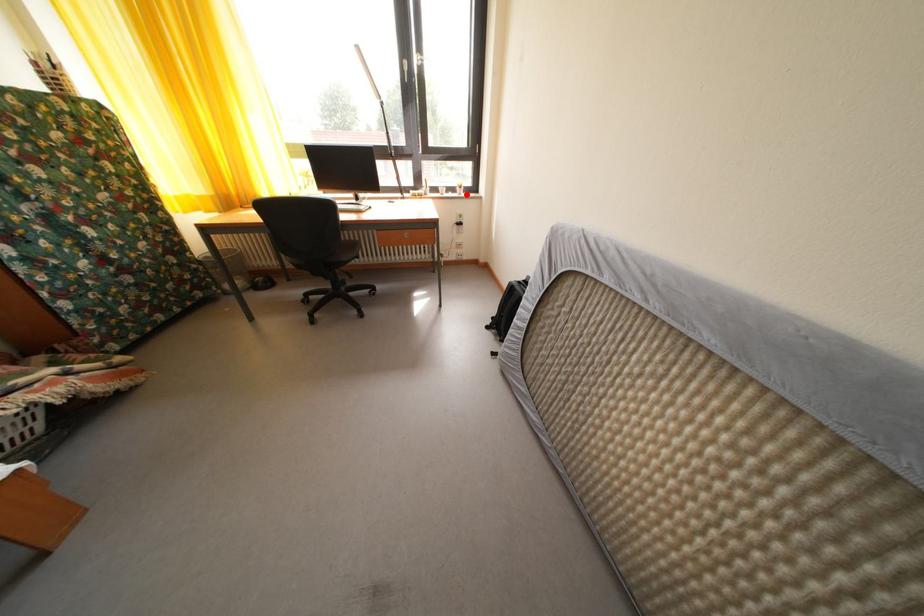
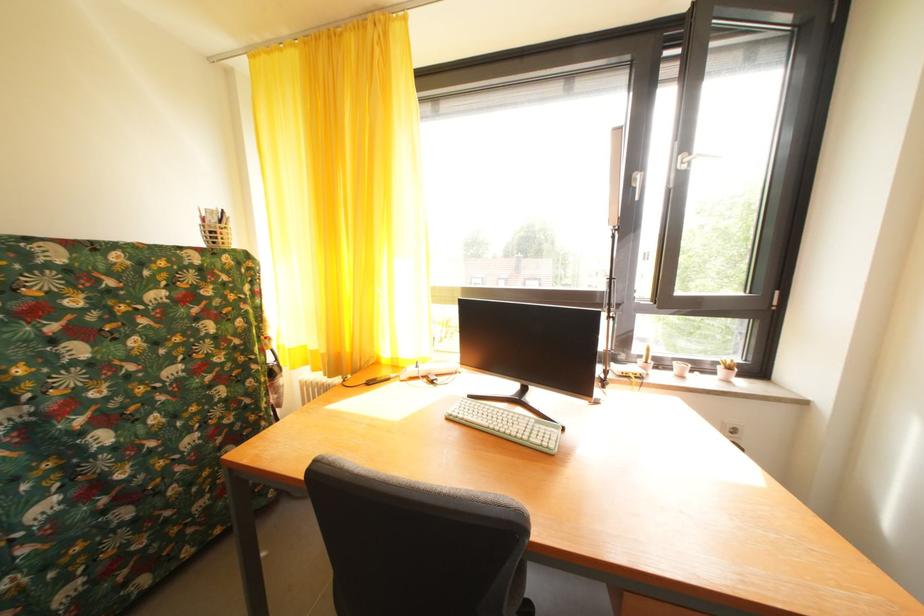
Question: I am providing you with two images of the same scene from different viewpoints. Given a red point in image1, look at the same physical point in image2. Is it:

Choices:
 (A) Closer to the viewpoint
 (B) Farther from the viewpoint

Answer: (B)